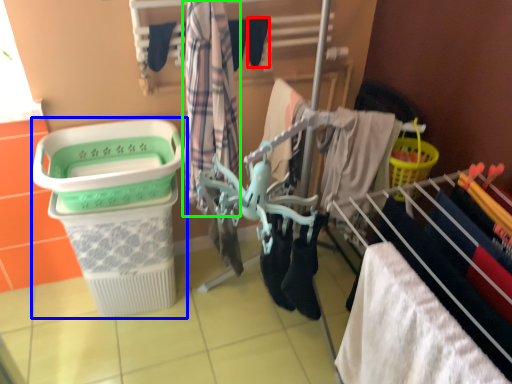
Question: Which is nearer to the shoe (highlighted by a red box)? shopping basket (highlighted by a blue box) or clothing (highlighted by a green box).

Choices:
 (A) shopping basket
 (B) clothing

Answer: (B)